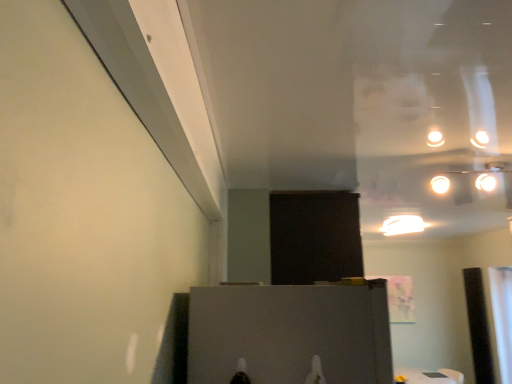
This screenshot has width=512, height=384. What do you see at coordinates (402, 224) in the screenshot?
I see `white glossy light fixture at upper center` at bounding box center [402, 224].

In order to face white glossy light fixture at upper center, should I rotate leftwards or rightwards?

Rotate right and turn 19.079 degrees.

The height and width of the screenshot is (384, 512). I want to click on white glossy light fixture at upper center, so click(x=402, y=224).

At what (x,y) coordinates should I click in order to perform the action: click on white glossy light fixture at upper center. Please return your answer as a coordinate pair (x, y). This screenshot has width=512, height=384. Looking at the image, I should click on (402, 224).